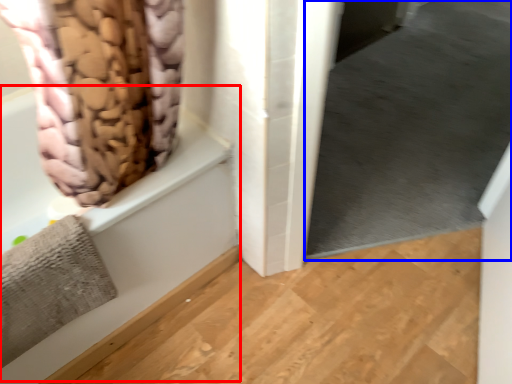
Question: Which of the following is the farthest to the observer, bath (highlighted by a red box) or window screen (highlighted by a blue box)?

Choices:
 (A) bath
 (B) window screen

Answer: (B)